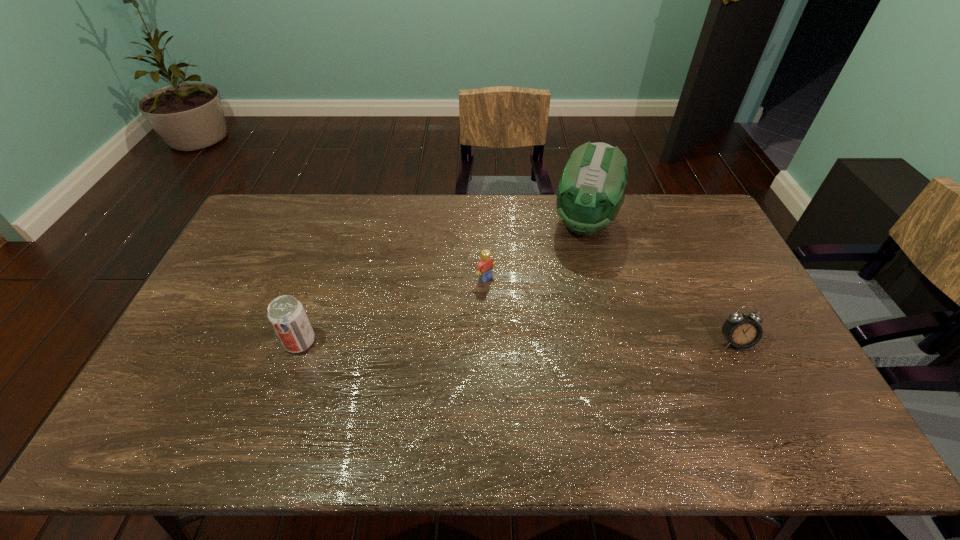
Locate an element on the screen. The width and height of the screenshot is (960, 540). the third shortest object is located at coordinates (286, 314).

This screenshot has height=540, width=960. Find the location of `soda can`. soda can is located at coordinates (286, 314).

In order to click on the rightmost object in this screenshot , I will do `click(741, 330)`.

Where is `the second farthest object`? the second farthest object is located at coordinates (484, 269).

Identify the location of Lego. This screenshot has height=540, width=960. (484, 269).

The image size is (960, 540). Identify the location of the second object from right to left. (590, 193).

I want to click on the farthest object, so click(x=590, y=193).

Where is `free space located on the left of the third shortest object`? The width and height of the screenshot is (960, 540). free space located on the left of the third shortest object is located at coordinates (262, 342).

Identify the location of blank area located 0.120m on the face of the rightmost object. (759, 392).

This screenshot has height=540, width=960. I want to click on vacant space situated 0.200m on the front-facing side of the second object from left to right, so [x=539, y=321].